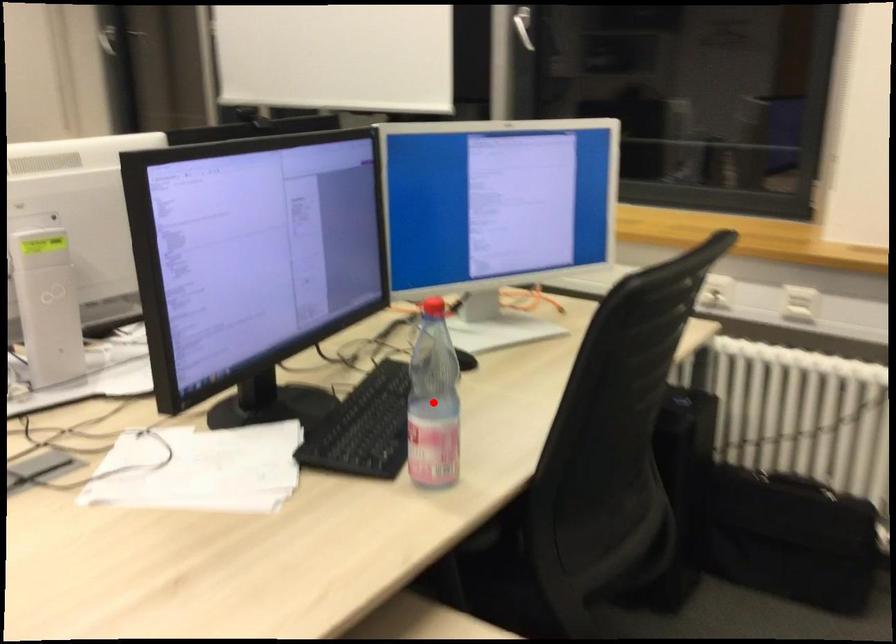
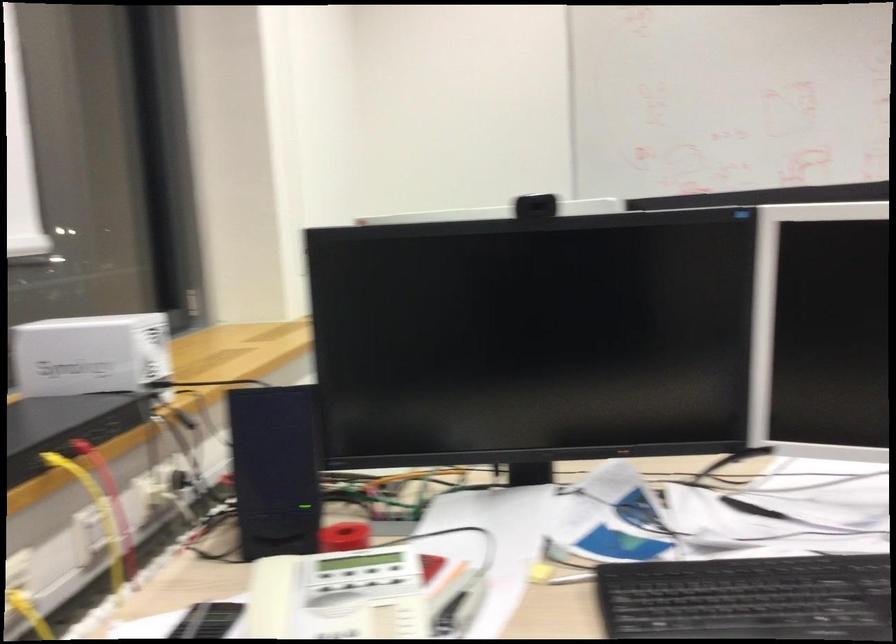
Question: I am providing you with two images of the same scene from different viewpoints. A red point is marked on the first image. At the location where the point appears in image 1, is it still visible in image 2?

Choices:
 (A) Yes
 (B) No

Answer: (B)